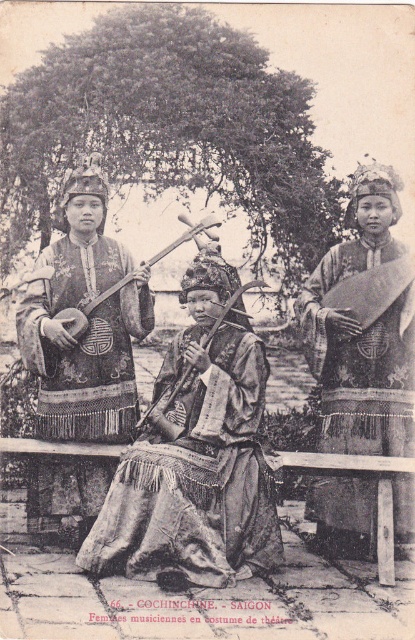
You are an art historian examining this historical photograph. You notice the silky brocade robe at right and the wooden carved lute at center. Based on their positions in the image, which object is closer to the viewer?

The silky brocade robe at right is closer to the viewer because it is positioned in front of the wooden carved lute at center.

You are a tailor measuring the width of the robes for a costume fitting. The customer has both the silky brocade robe at center and the silky dark brown robe at center. Which robe requires a wider fabric measurement?

The silky brocade robe at center requires a wider fabric measurement since its width surpasses that of the silky dark brown robe at center.

You are an artist trying to sketch this scene. You need to decide the order to draw the objects based on their height. Which object should you draw first, the silky dark brown robe at center or the wooden carved lute at center, considering their heights?

The wooden carved lute at center is taller than the silky dark brown robe at center, so you should draw the wooden carved lute at center first since it is taller.